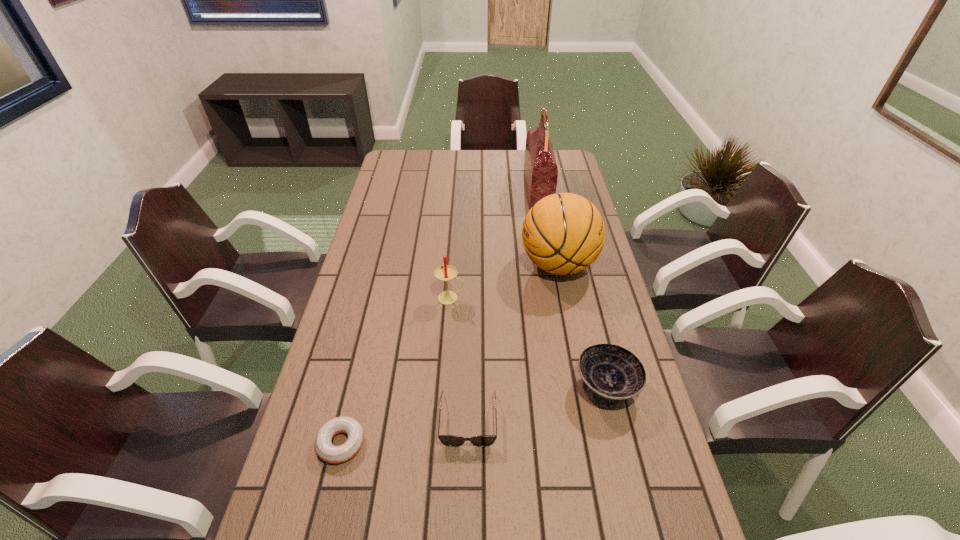
You are a GUI agent. You are given a task and a screenshot of the screen. Output one action in this format:
    pyautogui.click(x=<x>, y=<y>)
    Task: Click on the free region located 0.360m on the front-facing side of the handbag
    This screenshot has height=540, width=960.
    Given the screenshot: What is the action you would take?
    pyautogui.click(x=440, y=190)

Where is `vacant region located on the surface of the basketball near the brand logo`? The image size is (960, 540). vacant region located on the surface of the basketball near the brand logo is located at coordinates (499, 265).

Locate an element on the screen. This screenshot has width=960, height=540. vacant space located on the surface of the basketball near the brand logo is located at coordinates (502, 265).

At what (x,y) coordinates should I click in order to perform the action: click on free region located on the surface of the basketball near the brand logo. Please return your answer as a coordinate pair (x, y). Image resolution: width=960 pixels, height=540 pixels. Looking at the image, I should click on (416, 265).

What are the coordinates of `vacant region located 0.270m on the back of the fourth shortest object` in the screenshot? It's located at (455, 238).

Image resolution: width=960 pixels, height=540 pixels. I want to click on free region located on the left of the third shortest object, so click(516, 387).

Locate an element on the screen. The height and width of the screenshot is (540, 960). vacant space located at the front lenses of the sunglasses is located at coordinates (467, 502).

Where is `free space located 0.250m on the back of the doughnut`? The image size is (960, 540). free space located 0.250m on the back of the doughnut is located at coordinates (366, 341).

Find the location of `object at the far edge`. object at the far edge is located at coordinates (540, 168).

Where is `object that is at the left edge`? object that is at the left edge is located at coordinates (325, 450).